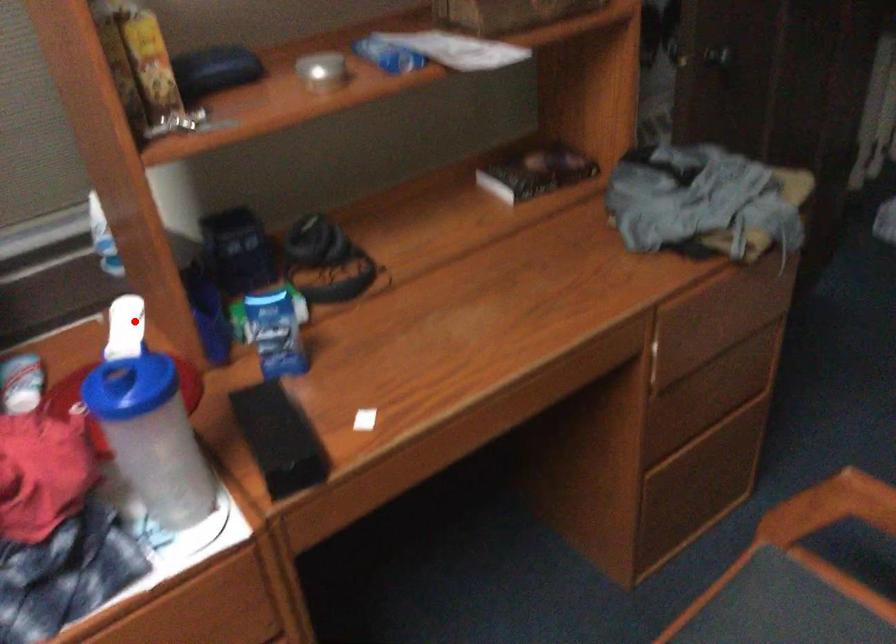
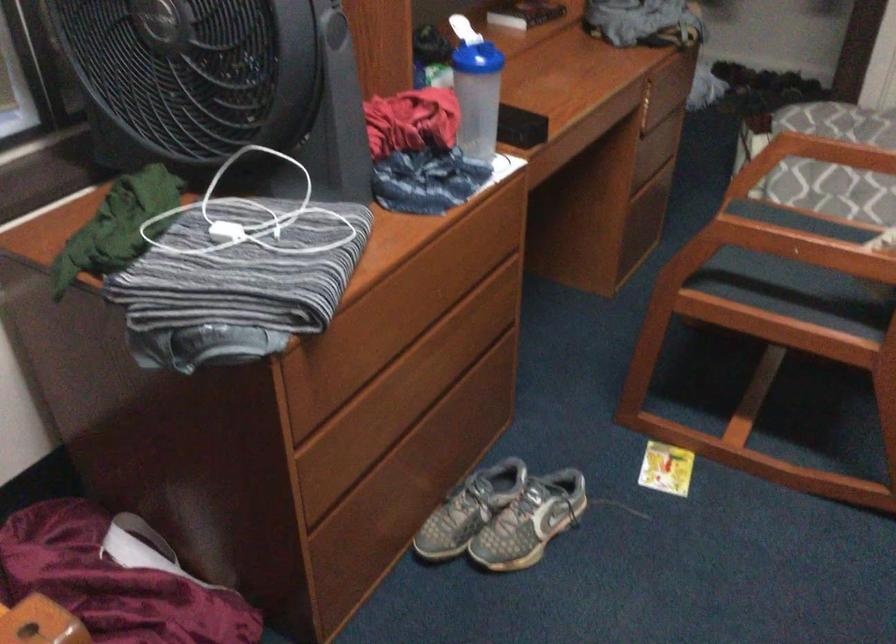
Question: I am providing you with two images of the same scene from different viewpoints. A red point is shown in image1. For the corresponding object point in image2, is it positioned nearer or farther from the camera?

Choices:
 (A) Nearer
 (B) Farther

Answer: (B)